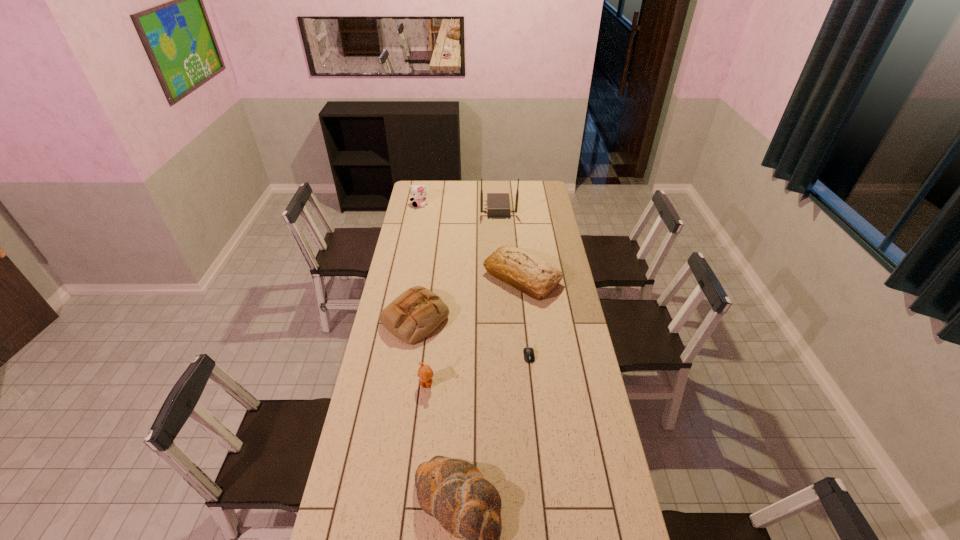
At what (x,y) coordinates should I click in order to perform the action: click on router. Please return your answer as a coordinate pair (x, y). Image resolution: width=960 pixels, height=540 pixels. Looking at the image, I should click on (498, 204).

Where is `kitten`? kitten is located at coordinates (418, 192).

At what (x,y) coordinates should I click in order to perform the action: click on teddy bear. Please return your answer as a coordinate pair (x, y). Looking at the image, I should click on (425, 373).

Locate an element on the screen. The height and width of the screenshot is (540, 960). computer equipment is located at coordinates (529, 356).

The height and width of the screenshot is (540, 960). What are the coordinates of `the shortest object` in the screenshot? It's located at (529, 356).

This screenshot has width=960, height=540. In order to click on free space located 0.060m on the back of the tallest object to connect cables in this screenshot , I will do `click(470, 208)`.

Identify the location of blank space located 0.120m on the back of the tallest object to connect cables. The image size is (960, 540). (461, 208).

Identify the location of blank area located on the back of the tallest object to connect cables. (429, 208).

Where is `free spot located on the front-facing side of the kitten`? free spot located on the front-facing side of the kitten is located at coordinates (414, 235).

You are a GUI agent. You are given a task and a screenshot of the screen. Output one action in this format:
    pyautogui.click(x=<x>, y=<y>)
    Task: Click on the vacant space situated 0.350m on the face of the teddy bear
    The width and height of the screenshot is (960, 540).
    Given the screenshot: What is the action you would take?
    pyautogui.click(x=416, y=480)